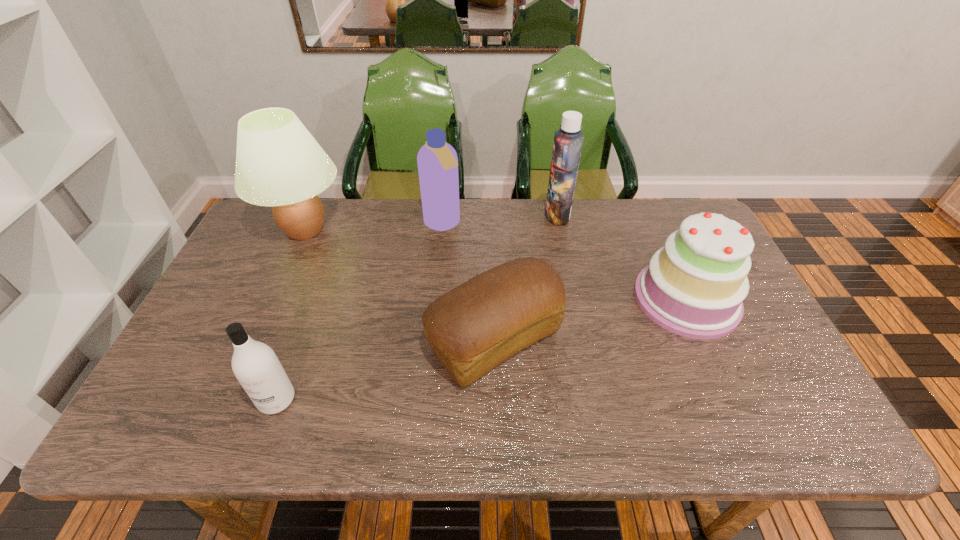
At what (x,y) coordinates should I click in order to perform the action: click on free space between the fifth object from left to right and the leftmost shampoo. Please return your answer as a coordinate pair (x, y). The image size is (960, 540). Looking at the image, I should click on (417, 307).

Locate which object is the fourth closest to the cake. Please provide its 2D coordinates. Your answer should be formatted as a tuple, i.e. [(x, y)], where the tuple contains the x and y coordinates of a point satisfying the conditions above.

[(279, 163)]

Locate which object is the third closest to the shortest object. Please provide its 2D coordinates. Your answer should be formatted as a tuple, i.e. [(x, y)], where the tuple contains the x and y coordinates of a point satisfying the conditions above.

[(255, 365)]

At what (x,y) coordinates should I click in order to perform the action: click on the second closest shampoo to the lampshade. Please return your answer as a coordinate pair (x, y). Looking at the image, I should click on (255, 365).

Where is `shampoo that stands as the closest to the second object from right to left`? The height and width of the screenshot is (540, 960). shampoo that stands as the closest to the second object from right to left is located at coordinates (437, 161).

Image resolution: width=960 pixels, height=540 pixels. Find the location of `vacant area in the image that satisfies the following two spatial constraints: 1. on the back side of the shortest object; 2. on the right side of the cake`. vacant area in the image that satisfies the following two spatial constraints: 1. on the back side of the shortest object; 2. on the right side of the cake is located at coordinates (493, 299).

Locate an element on the screen. The image size is (960, 540). free point that satisfies the following two spatial constraints: 1. on the front label of the second object from right to left; 2. on the front-facing side of the nearest shampoo is located at coordinates (595, 400).

This screenshot has width=960, height=540. What are the coordinates of `vacant space that satisfies the following two spatial constraints: 1. on the front label of the fifth object from left to right; 2. on the right side of the cake` in the screenshot? It's located at (575, 299).

This screenshot has width=960, height=540. I want to click on vacant space that satisfies the following two spatial constraints: 1. on the front label of the fifth object from left to right; 2. on the front side of the shortest object, so click(583, 340).

You are a GUI agent. You are given a task and a screenshot of the screen. Output one action in this format:
    pyautogui.click(x=<x>, y=<y>)
    Task: Click on the vacant space that satisfies the following two spatial constraints: 1. on the front label of the rightmost shampoo; 2. on the front-facing side of the nearest shampoo
    
    Given the screenshot: What is the action you would take?
    pyautogui.click(x=595, y=400)